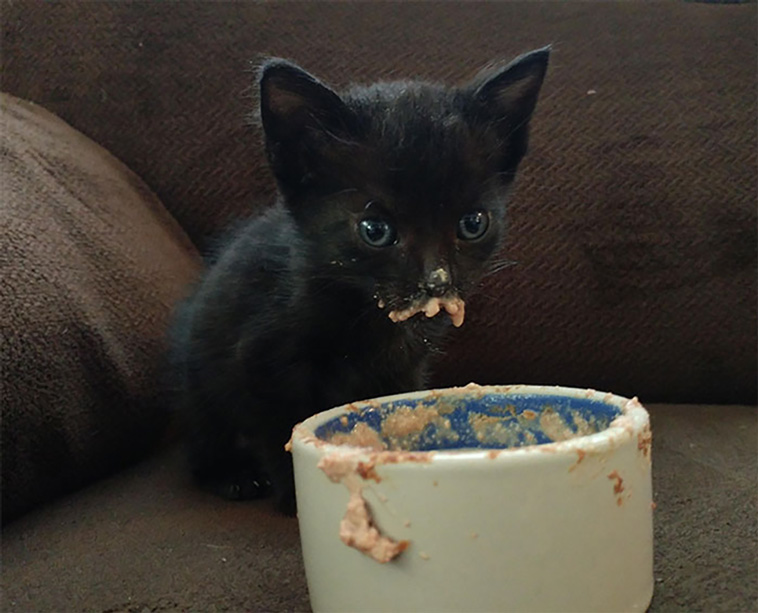
At what (x,y) coordinates should I click in order to perform the action: click on inside of bowl. Please return your answer as a coordinate pair (x, y). Looking at the image, I should click on (525, 404).